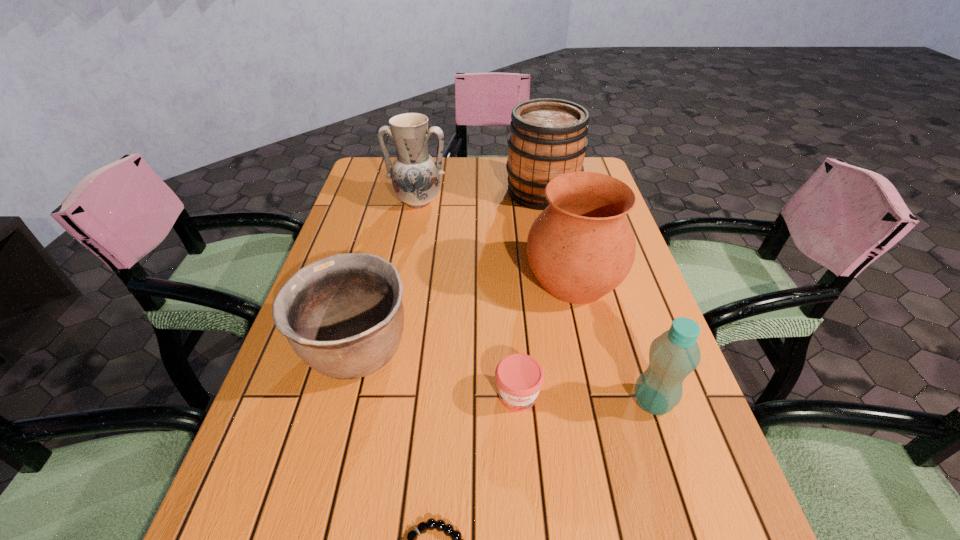
Locate an element on the screen. The image size is (960, 540). the farthest pottery is located at coordinates (415, 175).

Find the location of a particular element. cider is located at coordinates (548, 138).

In order to click on the rightmost pottery in this screenshot , I will do `click(581, 247)`.

Where is `the fourth shortest object`? The width and height of the screenshot is (960, 540). the fourth shortest object is located at coordinates (673, 355).

At what (x,y) coordinates should I click in order to perform the action: click on the fifth tallest object. Please return your answer as a coordinate pair (x, y). The width and height of the screenshot is (960, 540). Looking at the image, I should click on (343, 315).

Where is `jam`? The height and width of the screenshot is (540, 960). jam is located at coordinates (519, 377).

Where is `vacant space situated on either side of the farthest pottery`? Image resolution: width=960 pixels, height=540 pixels. vacant space situated on either side of the farthest pottery is located at coordinates (397, 307).

Where is `vacant space located 0.240m on the front of the cider`? This screenshot has height=540, width=960. vacant space located 0.240m on the front of the cider is located at coordinates (557, 264).

This screenshot has height=540, width=960. I want to click on free space located 0.300m on the front of the rightmost pottery, so click(612, 441).

Image resolution: width=960 pixels, height=540 pixels. I want to click on vacant space located at the front cap of the water bottle, so click(590, 402).